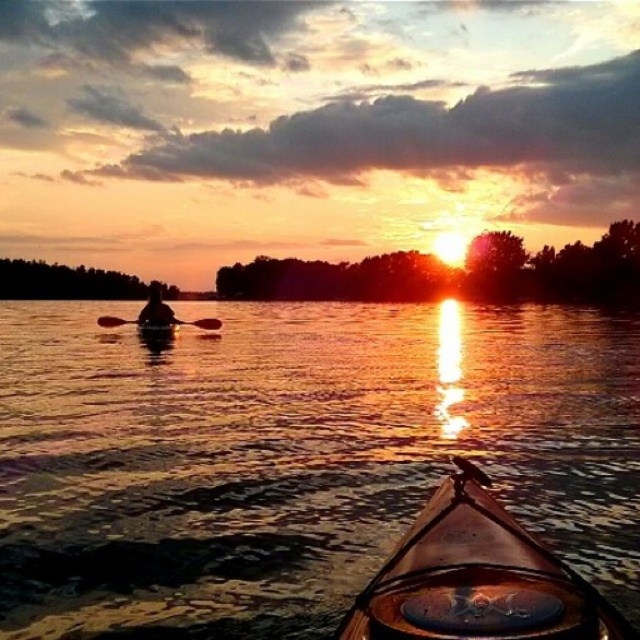
You are a kayaker who wants to reach the point where the sun is reflecting on the water. Based on the coordinates provided, can you determine if the transparent plastic kayak at center is positioned towards the left or right side of the scene?

The transparent plastic kayak at center is positioned at coordinates point (x=294, y=456). Since the x coordinate is 0.714, which is closer to 1 than 0, it is positioned towards the right side of the scene.

You are in a kayak watching the sunset. You need to reach for the black wood paddle at center to adjust your position. Based on its location, where should you extend your hand to grab it?

The black wood paddle at center is located at point coordinates 0.505 on the horizontal axis and 0.252 on the vertical axis, so you should extend your hand to the center area slightly towards the lower middle part of the kayak to grab it.